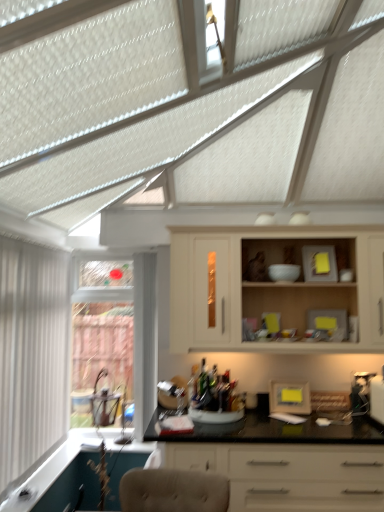
Question: Considering the relative sizes of yellow matte frame at center and clear glass window at left, which is the second window from front to back, in the image provided, is yellow matte frame at center shorter than clear glass window at left, which is the second window from front to back,?

Choices:
 (A) yes
 (B) no

Answer: (A)

Question: From the image's perspective, is yellow matte frame at center on clear glass window at left, which is the second window from front to back?

Choices:
 (A) yes
 (B) no

Answer: (B)

Question: Is yellow matte frame at center at the left side of clear glass window at left, which is the second window from front to back?

Choices:
 (A) yes
 (B) no

Answer: (B)

Question: Is yellow matte frame at center positioned behind clear glass window at left, which is the second window from front to back?

Choices:
 (A) no
 (B) yes

Answer: (A)

Question: Does yellow matte frame at center have a greater height compared to clear glass window at left, positioned as the first window in back-to-front order?

Choices:
 (A) no
 (B) yes

Answer: (A)

Question: Would you say yellow matte frame at center is a long distance from clear glass window at left, positioned as the first window in back-to-front order?

Choices:
 (A) no
 (B) yes

Answer: (B)

Question: Is yellow matte frame at center behind matte cream cabinet at center?

Choices:
 (A) no
 (B) yes

Answer: (B)

Question: Is yellow matte frame at center positioned far away from matte cream cabinet at center?

Choices:
 (A) yes
 (B) no

Answer: (B)

Question: Does yellow matte frame at center have a lesser width compared to matte cream cabinet at center?

Choices:
 (A) yes
 (B) no

Answer: (A)

Question: Considering the relative sizes of yellow matte frame at center and matte cream cabinet at center in the image provided, is yellow matte frame at center shorter than matte cream cabinet at center?

Choices:
 (A) yes
 (B) no

Answer: (A)

Question: Considering the relative positions of yellow matte frame at center and matte cream cabinet at center in the image provided, is yellow matte frame at center to the left of matte cream cabinet at center from the viewer's perspective?

Choices:
 (A) no
 (B) yes

Answer: (A)

Question: From the image's perspective, is yellow matte frame at center located above matte cream cabinet at center?

Choices:
 (A) no
 (B) yes

Answer: (A)

Question: Would you consider yellow matte frame at center to be distant from white vertical blinds at left, which ranks as the 1th window in front-to-back order?

Choices:
 (A) no
 (B) yes

Answer: (B)